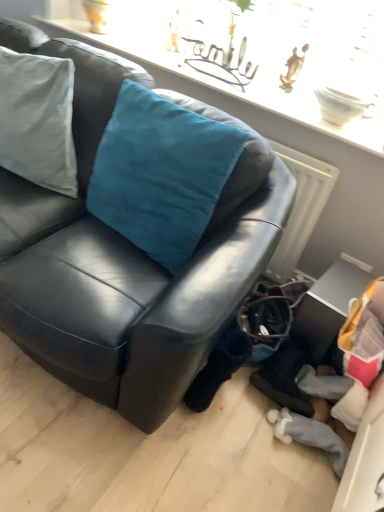
Question: In the image, is satin teal cushion at upper center positioned in front of or behind metallic silver table at lower right?

Choices:
 (A) behind
 (B) front

Answer: (A)

Question: Does point (372, 97) appear closer or farther from the camera than point (336, 295)?

Choices:
 (A) closer
 (B) farther

Answer: (B)

Question: Which object is positioned farthest from the black leather couch at center?

Choices:
 (A) satin teal cushion at upper center
 (B) teal velvet cushion at upper left
 (C) metallic silver table at lower right

Answer: (A)

Question: Which is nearer to the metallic silver table at lower right?

Choices:
 (A) black leather couch at center
 (B) satin teal cushion at upper center
 (C) teal velvet cushion at upper left

Answer: (A)